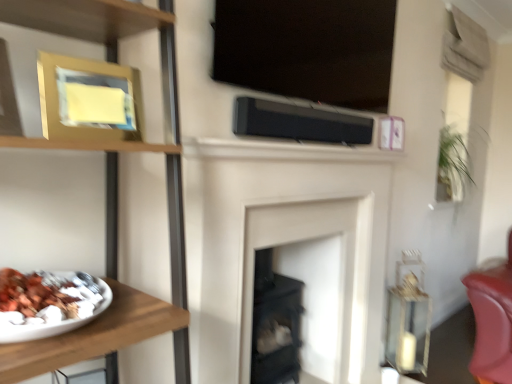
Question: Does wooden plate at left have a greater width compared to gold metallic picture frame at upper left?

Choices:
 (A) yes
 (B) no

Answer: (A)

Question: Considering the relative positions of wooden plate at left and gold metallic picture frame at upper left in the image provided, is wooden plate at left in front of gold metallic picture frame at upper left?

Choices:
 (A) no
 (B) yes

Answer: (B)

Question: From a real-world perspective, is wooden plate at left below gold metallic picture frame at upper left?

Choices:
 (A) no
 (B) yes

Answer: (B)

Question: Is wooden plate at left taller than gold metallic picture frame at upper left?

Choices:
 (A) yes
 (B) no

Answer: (A)

Question: Considering the relative positions of wooden plate at left and gold metallic picture frame at upper left in the image provided, is wooden plate at left to the right of gold metallic picture frame at upper left from the viewer's perspective?

Choices:
 (A) yes
 (B) no

Answer: (A)

Question: From a real-world perspective, relative to white matte fireplace at center, is gold metallic picture frame at upper left vertically above or below?

Choices:
 (A) below
 (B) above

Answer: (B)

Question: From the image's perspective, is gold metallic picture frame at upper left positioned above or below white matte fireplace at center?

Choices:
 (A) below
 (B) above

Answer: (B)

Question: Is gold metallic picture frame at upper left bigger or smaller than white matte fireplace at center?

Choices:
 (A) big
 (B) small

Answer: (B)

Question: In terms of width, does gold metallic picture frame at upper left look wider or thinner when compared to white matte fireplace at center?

Choices:
 (A) thin
 (B) wide

Answer: (B)

Question: From the image's perspective, is white matte fireplace at center above or below black matte speaker at center?

Choices:
 (A) below
 (B) above

Answer: (A)

Question: Relative to black matte speaker at center, is white matte fireplace at center in front or behind?

Choices:
 (A) behind
 (B) front

Answer: (B)

Question: Looking at the image, does white matte fireplace at center seem bigger or smaller compared to black matte speaker at center?

Choices:
 (A) big
 (B) small

Answer: (A)

Question: Considering the positions of white matte fireplace at center and black matte speaker at center in the image, is white matte fireplace at center taller or shorter than black matte speaker at center?

Choices:
 (A) tall
 (B) short

Answer: (A)

Question: Is wooden plate at left spatially inside white matte fireplace at center, or outside of it?

Choices:
 (A) outside
 (B) inside

Answer: (A)

Question: From the image's perspective, is wooden plate at left above or below white matte fireplace at center?

Choices:
 (A) above
 (B) below

Answer: (A)